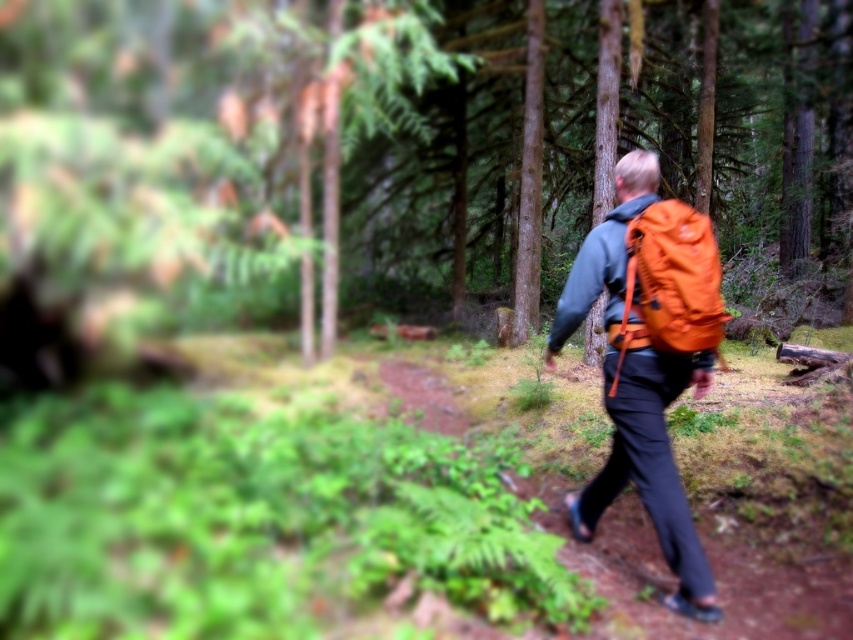
Who is more distant from viewer, (83, 70) or (660, 209)?

Positioned behind is point (83, 70).

Identify the location of green matte tree at center. (584, 129).

Is orange fabric backpack at right below orange fabric backpack at center?

No.

Who is lower down, orange fabric backpack at right or orange fabric backpack at center?

Positioned lower is orange fabric backpack at center.

Is point (628, 224) more distant than point (635, 540)?

No, it is in front of (635, 540).

The width and height of the screenshot is (853, 640). Find the location of `orange fabric backpack at right`. orange fabric backpack at right is located at coordinates (648, 356).

From the picture: Is orange fabric backpack at center to the left of orange fabric backpack at upper right from the viewer's perspective?

Indeed, orange fabric backpack at center is positioned on the left side of orange fabric backpack at upper right.

Does orange fabric backpack at center have a greater width compared to orange fabric backpack at upper right?

Correct, the width of orange fabric backpack at center exceeds that of orange fabric backpack at upper right.

Which is in front, point (849, 564) or point (664, 346)?

Point (664, 346)

This screenshot has width=853, height=640. Identify the location of orange fabric backpack at center. tap(717, 580).